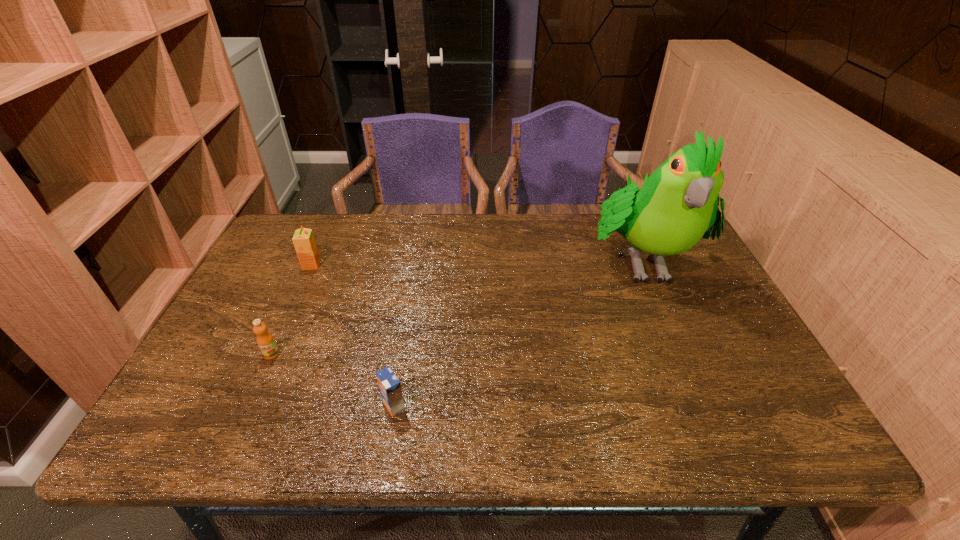
Where is `empty space that is in between the tallest object and the nearest orange_juice`? This screenshot has height=540, width=960. empty space that is in between the tallest object and the nearest orange_juice is located at coordinates (517, 333).

The image size is (960, 540). I want to click on empty space that is in between the third object from left to right and the farthest orange_juice, so click(x=352, y=335).

Locate an element on the screen. Image resolution: width=960 pixels, height=540 pixels. vacant region between the farthest orange_juice and the nearest orange_juice is located at coordinates (352, 335).

Image resolution: width=960 pixels, height=540 pixels. In order to click on vacant region between the farthest orange_juice and the rightmost object in this screenshot , I will do `click(476, 263)`.

At what (x,y) coordinates should I click in order to perform the action: click on vacant space in between the tallest object and the farthest orange_juice. Please return your answer as a coordinate pair (x, y). Image resolution: width=960 pixels, height=540 pixels. Looking at the image, I should click on (476, 263).

The image size is (960, 540). I want to click on free spot between the tallest object and the farthest orange_juice, so click(476, 263).

In order to click on empty space that is in between the rightmost object and the farthest orange_juice in this screenshot , I will do `click(476, 263)`.

You are a GUI agent. You are given a task and a screenshot of the screen. Output one action in this format:
    pyautogui.click(x=<x>, y=<y>)
    Task: Click on the blank region between the tallest object and the rightmost orange_juice
    
    Given the screenshot: What is the action you would take?
    pyautogui.click(x=517, y=333)

Where is `empty location between the second object from right to left and the tallest object`? empty location between the second object from right to left and the tallest object is located at coordinates (517, 333).

Identify which object is located as the nearest to the second nearest orange_juice. Please provide its 2D coordinates. Your answer should be formatted as a tuple, i.e. [(x, y)], where the tuple contains the x and y coordinates of a point satisfying the conditions above.

[(389, 385)]